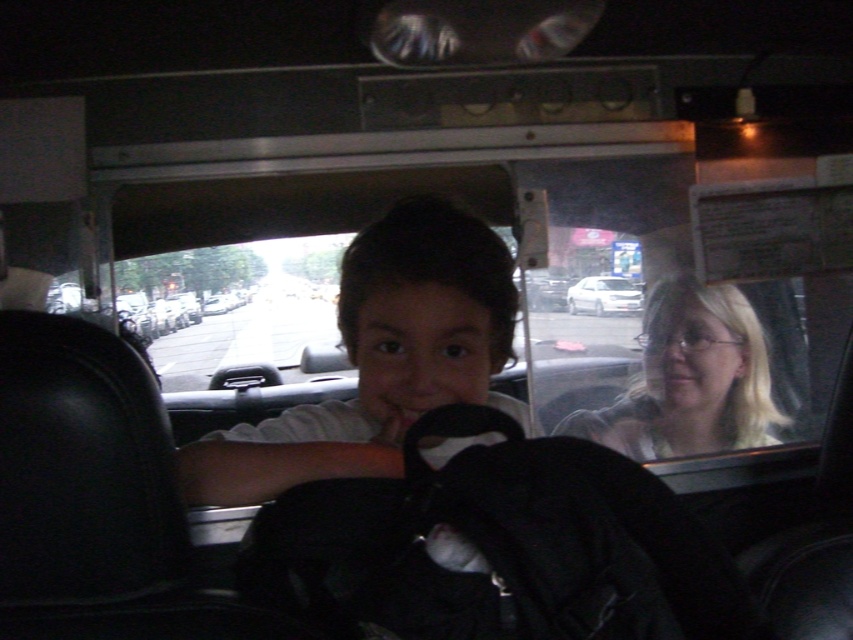
You are a passenger in the vehicle and want to reach the white glossy sedan at center from the blonde hair at center. Is the distance between them sufficient for you to comfortably stretch your hand without moving your seat?

The distance between the blonde hair at center and the white glossy sedan at center is 7.99 inches, which is sufficient for a passenger to comfortably stretch their hand without moving their seat.

You are a safety inspector checking the vehicle for proper child restraint positioning. According to the image, where exactly is the smooth skin child at center positioned in terms of coordinates?

The smooth skin child at center is positioned at coordinates point (380, 358).

You are sitting in the back seat of the vehicle and want to reach for an object located at point (445, 294) and another object at point (715, 428). Which point is closer to you?

Point (445, 294) is closer to the viewer than point (715, 428).